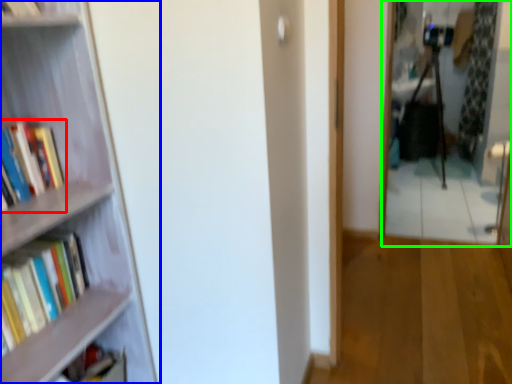
Question: Which is farther away from book (highlighted by a red box)? bookcase (highlighted by a blue box) or mirror (highlighted by a green box)?

Choices:
 (A) bookcase
 (B) mirror

Answer: (B)